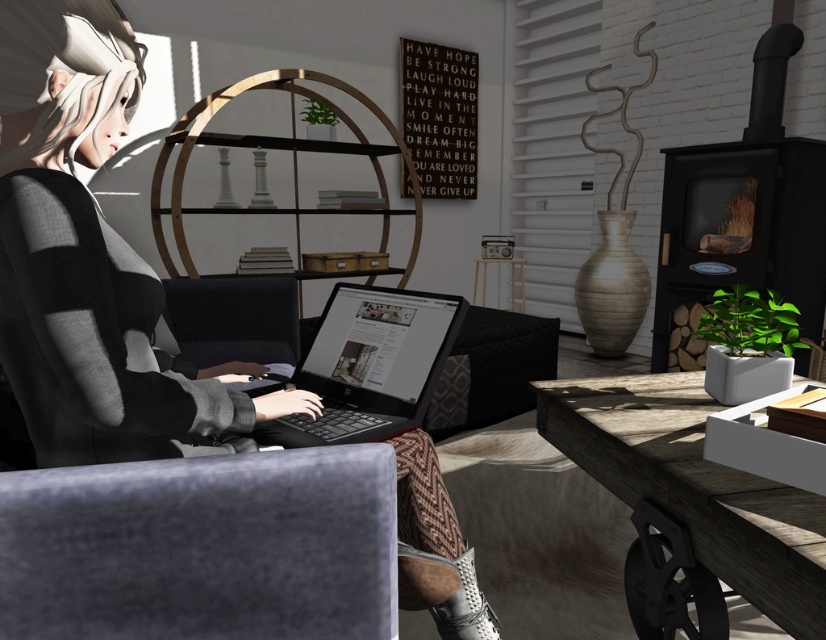
Is matte black laptop at center positioned in front of black plastic laptop at center?

That is True.

Can you confirm if matte black laptop at center is taller than black plastic laptop at center?

Yes, matte black laptop at center is taller than black plastic laptop at center.

Image resolution: width=826 pixels, height=640 pixels. I want to click on matte black laptop at center, so click(91, 260).

Locate an element on the screen. The image size is (826, 640). matte black laptop at center is located at coordinates (91, 260).

Is matte black laptop at center to the left of black fabric armchair at center from the viewer's perspective?

No, matte black laptop at center is not to the left of black fabric armchair at center.

Who is more distant from viewer, (476, 604) or (174, 333)?

Point (174, 333)

You are a GUI agent. You are given a task and a screenshot of the screen. Output one action in this format:
    pyautogui.click(x=<x>, y=<y>)
    Task: Click on the matte black laptop at center
    This screenshot has height=640, width=826.
    Given the screenshot: What is the action you would take?
    pyautogui.click(x=91, y=260)

Can you confirm if matte black laptop at center is positioned to the left of wooden table at lower right?

Indeed, matte black laptop at center is positioned on the left side of wooden table at lower right.

Does matte black laptop at center appear over wooden table at lower right?

Yes.

Which is in front, point (83, 266) or point (698, 408)?

Point (83, 266) is in front.

I want to click on matte black laptop at center, so click(x=91, y=260).